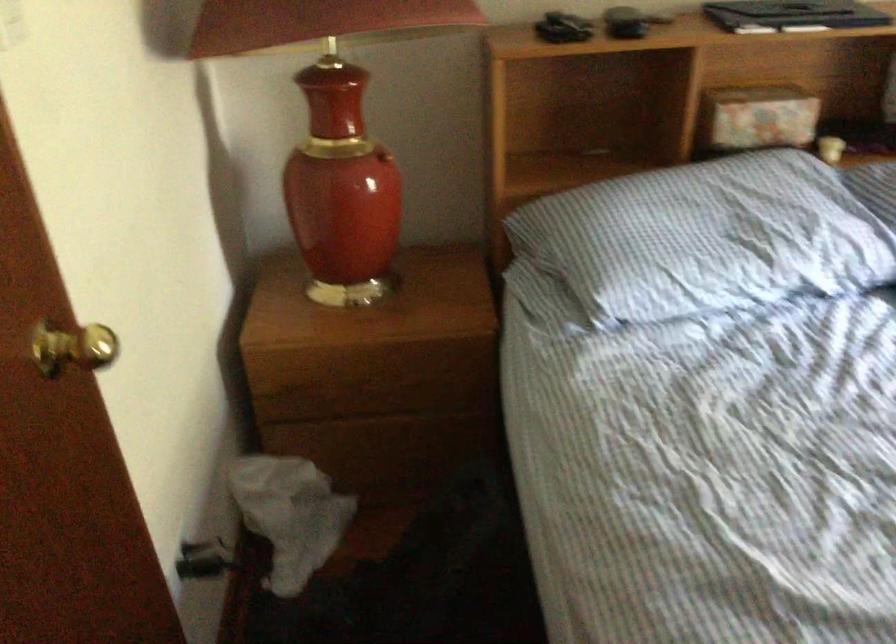
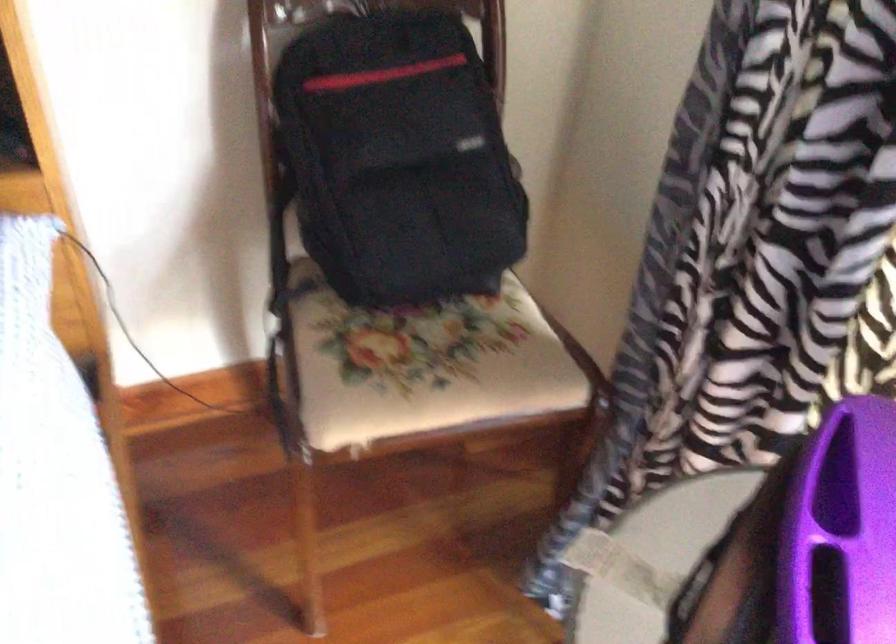
In a continuous first-person perspective shot, in which direction is the camera moving?

The cameraman walked toward right, forward.